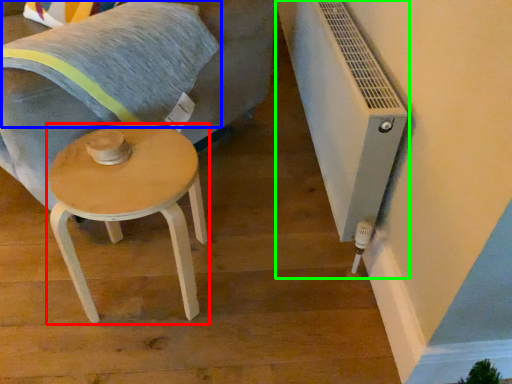
Question: Which object is positioned closest to stool (highlighted by a red box)? Select from pillow (highlighted by a blue box) and air conditioning (highlighted by a green box).

Choices:
 (A) pillow
 (B) air conditioning

Answer: (A)